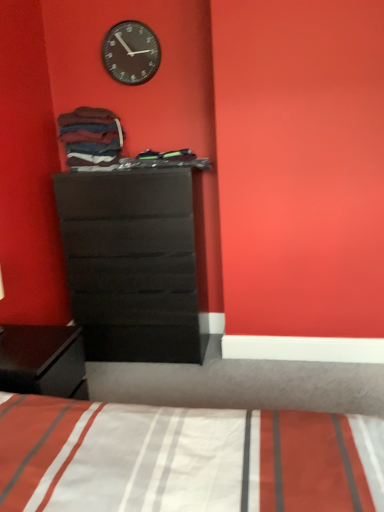
Question: Could matte black dresser at center be considered to be inside black matte clock at upper center?

Choices:
 (A) yes
 (B) no

Answer: (B)

Question: Does black matte clock at upper center lie in front of matte black dresser at center?

Choices:
 (A) no
 (B) yes

Answer: (A)

Question: Is black matte clock at upper center taller than matte black dresser at center?

Choices:
 (A) yes
 (B) no

Answer: (B)

Question: Is black matte clock at upper center far away from matte black dresser at center?

Choices:
 (A) yes
 (B) no

Answer: (A)

Question: Can you confirm if black matte clock at upper center is smaller than matte black dresser at center?

Choices:
 (A) no
 (B) yes

Answer: (B)

Question: Considering the positions of matte black dresser at center and black matte clock at upper center in the image, is matte black dresser at center wider or thinner than black matte clock at upper center?

Choices:
 (A) wide
 (B) thin

Answer: (A)

Question: Is matte black dresser at center spatially inside black matte clock at upper center, or outside of it?

Choices:
 (A) outside
 (B) inside

Answer: (A)

Question: Relative to black matte clock at upper center, is matte black dresser at center in front or behind?

Choices:
 (A) front
 (B) behind

Answer: (A)

Question: From a real-world perspective, is matte black dresser at center physically located above or below black matte clock at upper center?

Choices:
 (A) below
 (B) above

Answer: (A)

Question: From the image's perspective, is matte black dresser at center located above or below dark brown cotton socks at upper left?

Choices:
 (A) below
 (B) above

Answer: (A)

Question: Is point (177, 313) closer or farther from the camera than point (104, 160)?

Choices:
 (A) closer
 (B) farther

Answer: (B)

Question: In terms of width, does matte black dresser at center look wider or thinner when compared to dark brown cotton socks at upper left?

Choices:
 (A) wide
 (B) thin

Answer: (A)

Question: Is matte black dresser at center to the left or to the right of dark brown cotton socks at upper left in the image?

Choices:
 (A) left
 (B) right

Answer: (B)

Question: Is black matte clock at upper center in front of or behind matte black dresser at center in the image?

Choices:
 (A) front
 (B) behind

Answer: (B)

Question: Is black matte clock at upper center to the left or to the right of matte black dresser at center in the image?

Choices:
 (A) left
 (B) right

Answer: (A)